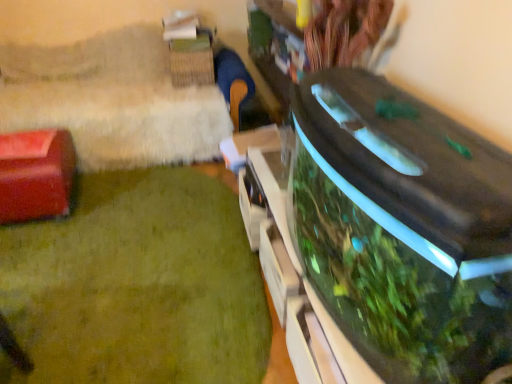
Question: Considering the relative sizes of green glossy aquarium at lower right and transparent glass aquarium at right in the image provided, is green glossy aquarium at lower right smaller than transparent glass aquarium at right?

Choices:
 (A) yes
 (B) no

Answer: (A)

Question: Considering the relative positions of green glossy aquarium at lower right and transparent glass aquarium at right in the image provided, is green glossy aquarium at lower right to the left of transparent glass aquarium at right from the viewer's perspective?

Choices:
 (A) yes
 (B) no

Answer: (A)

Question: Is green glossy aquarium at lower right taller than transparent glass aquarium at right?

Choices:
 (A) no
 (B) yes

Answer: (A)

Question: From a real-world perspective, is green glossy aquarium at lower right located beneath transparent glass aquarium at right?

Choices:
 (A) no
 (B) yes

Answer: (B)

Question: Does green glossy aquarium at lower right come in front of transparent glass aquarium at right?

Choices:
 (A) no
 (B) yes

Answer: (A)

Question: Is transparent glass aquarium at right a part of green glossy aquarium at lower right?

Choices:
 (A) yes
 (B) no

Answer: (B)

Question: Would you say matte red box at left is a long distance from transparent glass aquarium at right?

Choices:
 (A) yes
 (B) no

Answer: (A)

Question: From a real-world perspective, is matte red box at left over transparent glass aquarium at right?

Choices:
 (A) yes
 (B) no

Answer: (A)

Question: Would you say matte red box at left is outside transparent glass aquarium at right?

Choices:
 (A) no
 (B) yes

Answer: (B)

Question: Is matte red box at left smaller than transparent glass aquarium at right?

Choices:
 (A) no
 (B) yes

Answer: (B)

Question: Is matte red box at left to the right of transparent glass aquarium at right from the viewer's perspective?

Choices:
 (A) no
 (B) yes

Answer: (A)

Question: From the image's perspective, is matte red box at left on transparent glass aquarium at right?

Choices:
 (A) yes
 (B) no

Answer: (A)

Question: Considering the relative positions of green glossy aquarium at lower right and matte red box at left in the image provided, is green glossy aquarium at lower right behind matte red box at left?

Choices:
 (A) yes
 (B) no

Answer: (B)